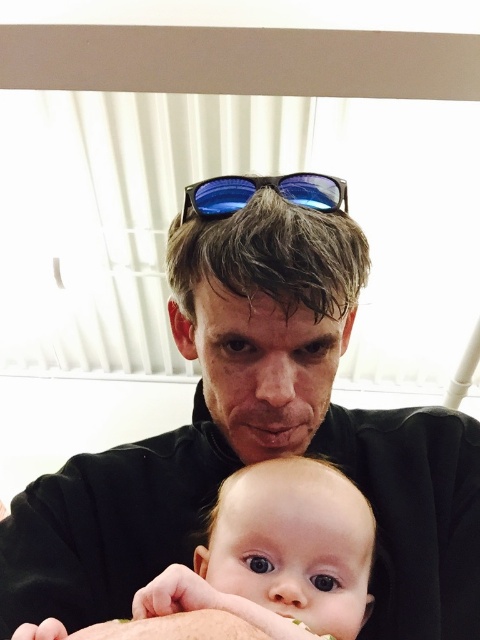
Question: Does black matte shirt at center appear under blue reflective lenses at center?

Choices:
 (A) yes
 (B) no

Answer: (A)

Question: Based on their relative distances, which object is nearer to the black matte shirt at center?

Choices:
 (A) blue reflective lenses at center
 (B) smooth skin baby at center

Answer: (B)

Question: Estimate the real-world distances between objects in this image. Which object is farther from the black matte shirt at center?

Choices:
 (A) blue reflective lenses at center
 (B) smooth skin baby at center

Answer: (A)

Question: Does black matte shirt at center come behind smooth skin baby at center?

Choices:
 (A) no
 (B) yes

Answer: (B)

Question: Can you confirm if black matte shirt at center is positioned below smooth skin baby at center?

Choices:
 (A) no
 (B) yes

Answer: (A)

Question: Considering the real-world distances, which object is farthest from the blue reflective lenses at center?

Choices:
 (A) smooth skin baby at center
 (B) black matte shirt at center

Answer: (A)